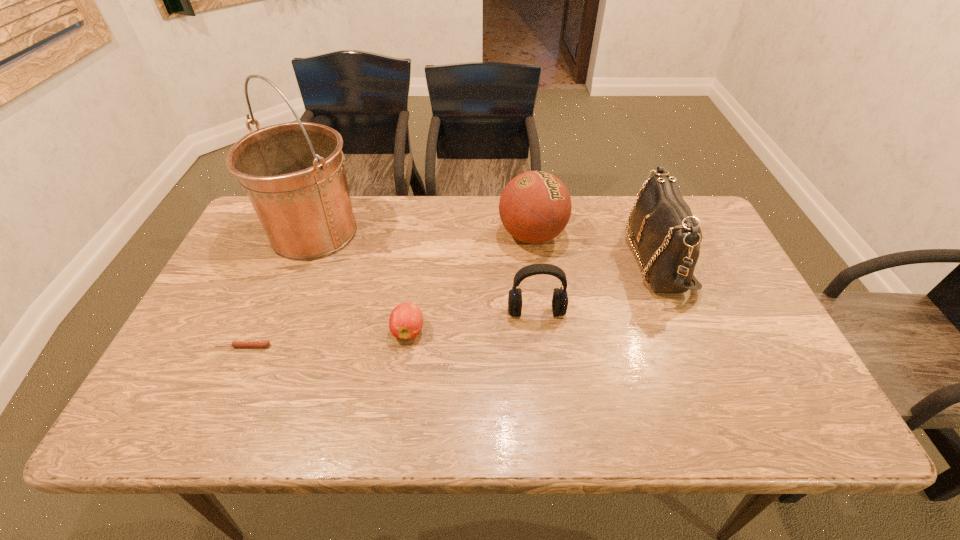
What are the coordinates of `vacant space that is in between the fourth tallest object and the tallest object` in the screenshot? It's located at (425, 272).

At what (x,y) coordinates should I click in order to perform the action: click on vacant space in between the basketball and the apple. Please return your answer as a coordinate pair (x, y). This screenshot has width=960, height=540. Looking at the image, I should click on (470, 283).

Identify the location of unoccupied area between the handbag and the third shortest object. (596, 284).

The height and width of the screenshot is (540, 960). Identify the location of vacant space that's between the basketball and the second shortest object. (470, 283).

The height and width of the screenshot is (540, 960). I want to click on vacant space in between the handbag and the tallest object, so click(x=486, y=245).

Locate an element on the screen. free space that is in between the headset and the handbag is located at coordinates (596, 284).

The height and width of the screenshot is (540, 960). What are the coordinates of `blank region between the tallest object and the shortest object` in the screenshot? It's located at (278, 289).

Where is `vacant area between the sausage and the apple`? vacant area between the sausage and the apple is located at coordinates (325, 338).

Identify which object is the third closest to the bucket. Please provide its 2D coordinates. Your answer should be formatted as a tuple, i.e. [(x, y)], where the tuple contains the x and y coordinates of a point satisfying the conditions above.

[(535, 207)]

You are a GUI agent. You are given a task and a screenshot of the screen. Output one action in this format:
    pyautogui.click(x=<x>, y=<y>)
    Task: Click on the object that is the fourth closest to the third object from left to right
    
    Given the screenshot: What is the action you would take?
    pyautogui.click(x=535, y=207)